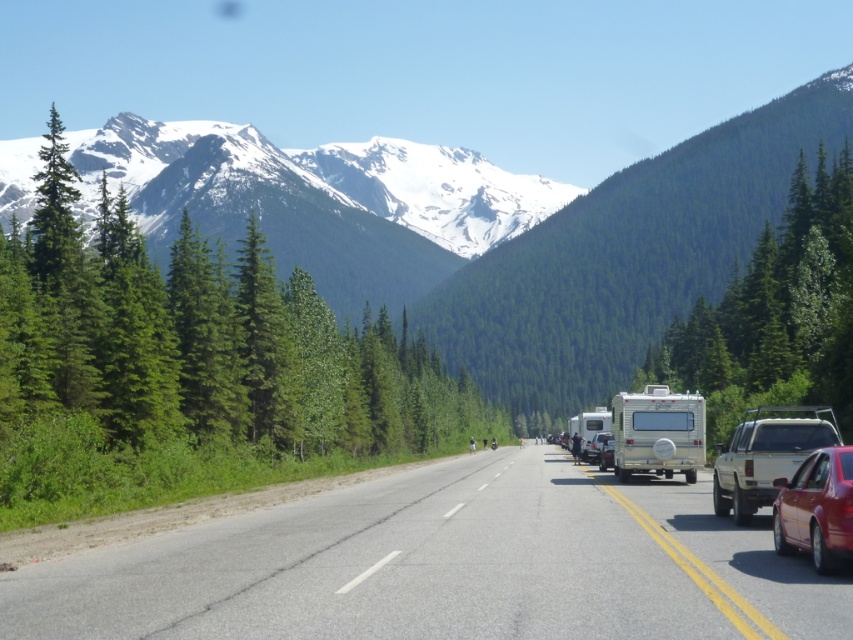
You are a driver approaching the highway and see the point marked at coordinates (x=816, y=508). What vehicle is located at that point?

The point at (x=816, y=508) indicates a shiny red sedan at lower right.